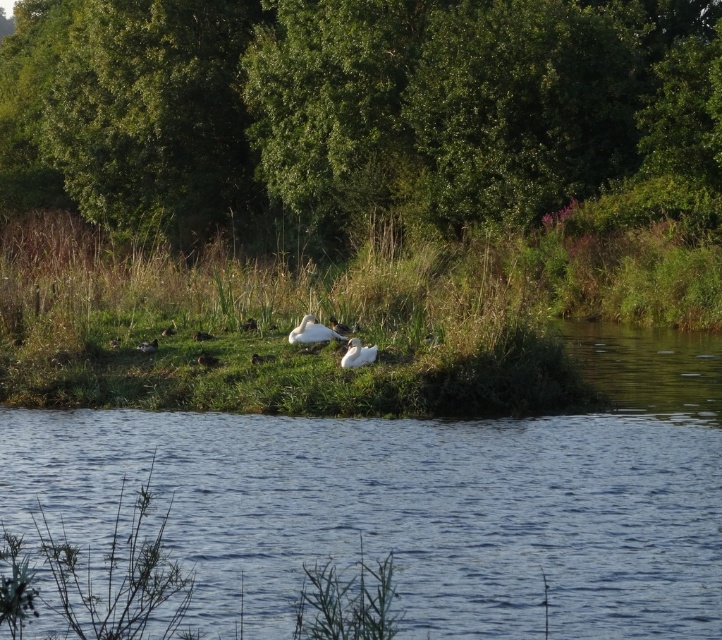
Question: Is green leafy tree at upper center smaller than green grass at center?

Choices:
 (A) yes
 (B) no

Answer: (B)

Question: Which of the following is the closest to the observer?

Choices:
 (A) (326, 422)
 (B) (456, 163)
 (C) (303, 332)

Answer: (A)

Question: Estimate the real-world distances between objects in this image. Which object is farther from the white feathered bird at lower left?

Choices:
 (A) white feathered goose at center
 (B) white fluffy goose at center
 (C) blue water at center

Answer: (C)

Question: Does blue water at center have a greater width compared to green grass at center?

Choices:
 (A) no
 (B) yes

Answer: (A)

Question: Can you confirm if white feathered goose at center is positioned to the right of white feathered bird at lower left?

Choices:
 (A) yes
 (B) no

Answer: (A)

Question: Which point is farther from the camera taking this photo?

Choices:
 (A) (513, 260)
 (B) (152, 342)
 (C) (318, 93)
 (D) (342, 365)

Answer: (C)